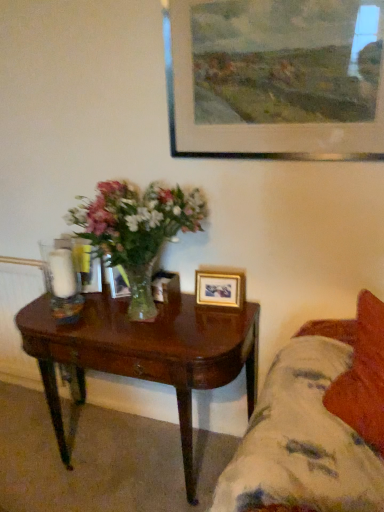
In order to face wooden picture frame at center, which is the third picture frame in front-to-back order, should I rotate leftwards or rightwards?

A 4.024 degree turn to the left will do.

What is the approximate width of dark wood coffee table at lower left?

44.66 centimeters.

I want to click on fluffy fabric couch at lower right, so click(x=316, y=424).

What do you see at coordinates (316, 424) in the screenshot? The image size is (384, 512). I see `fluffy fabric couch at lower right` at bounding box center [316, 424].

At what (x,y) coordinates should I click in order to perform the action: click on wooden picture frame at center, the 3th picture frame when ordered from top to bottom. Please return your answer as a coordinate pair (x, y). Looking at the image, I should click on (165, 286).

Looking at this image, from the image's perspective, does white glass candle holder at left appear lower than dark wood coffee table at lower left?

No, from the image's perspective, white glass candle holder at left is not beneath dark wood coffee table at lower left.

Which point is more distant from viewer, (61, 292) or (258, 313)?

Positioned behind is point (258, 313).

Choose the correct answer: Is white glass candle holder at left inside dark wood coffee table at lower left or outside it?

white glass candle holder at left exists outside the volume of dark wood coffee table at lower left.

Is white glass candle holder at left with dark wood coffee table at lower left?

They are not placed beside each other.

In the scene shown: Is white glass candle holder at left positioned with its back to fluffy fabric couch at lower right?

No, fluffy fabric couch at lower right is not at the back of white glass candle holder at left.

Is point (58, 283) positioned after point (366, 416)?

Yes, point (58, 283) is farther from viewer.

Which of these two, white glass candle holder at left or fluffy fabric couch at lower right, stands shorter?

Standing shorter between the two is white glass candle holder at left.

Measure the distance from white glass candle holder at left to fluffy fabric couch at lower right.

They are 1.00 meters apart.

Is wooden picture frame at center, the 3th picture frame when ordered from top to bottom, in front of or behind wooden picture frame at upper center, acting as the first picture frame starting from the top, in the image?

Visually, wooden picture frame at center, the 3th picture frame when ordered from top to bottom, is located behind wooden picture frame at upper center, acting as the first picture frame starting from the top.

From the image's perspective, between wooden picture frame at center, the 3th picture frame when ordered from top to bottom, and wooden picture frame at upper center, which is the 1th picture frame in front-to-back order, who is located below?

wooden picture frame at center, the 3th picture frame when ordered from top to bottom.

This screenshot has height=512, width=384. I want to click on the 2nd picture frame counting from the left of the wooden picture frame at upper center, which is the third picture frame from bottom to top, so click(165, 286).

Is wooden picture frame at upper center, which is the 1th picture frame in front-to-back order, inside wooden picture frame at center, which is counted as the first picture frame, starting from the back?

No.

How much distance is there between dark wood coffee table at lower left and fluffy fabric couch at lower right?

They are 19.92 inches apart.

Is dark wood coffee table at lower left next to fluffy fabric couch at lower right?

No, dark wood coffee table at lower left is not in contact with fluffy fabric couch at lower right.

Considering the positions of points (200, 382) and (269, 481), is point (200, 382) closer to camera compared to point (269, 481)?

No.

Considering the relative positions of dark wood coffee table at lower left and fluffy fabric couch at lower right in the image provided, is dark wood coffee table at lower left to the left or to the right of fluffy fabric couch at lower right?

From the image, it's evident that dark wood coffee table at lower left is to the left of fluffy fabric couch at lower right.

Consider the image. Does wooden picture frame at upper center, acting as the first picture frame starting from the top, have a larger size compared to wooden picture frame at center, which is the third picture frame in front-to-back order?

Yes, wooden picture frame at upper center, acting as the first picture frame starting from the top, is bigger than wooden picture frame at center, which is the third picture frame in front-to-back order.

This screenshot has width=384, height=512. Identify the location of the 2nd picture frame positioned above the wooden picture frame at center, the first picture frame positioned from the bottom (from the image's perspective). (275, 78).

Is wooden picture frame at upper center, acting as the first picture frame starting from the top, positioned far away from wooden picture frame at center, which is counted as the first picture frame, starting from the back?

They are positioned close to each other.

Which is correct: wooden picture frame at upper center, acting as the first picture frame starting from the top, is inside wooden picture frame at center, which is the third picture frame in front-to-back order, or outside of it?

wooden picture frame at upper center, acting as the first picture frame starting from the top, is located beyond the bounds of wooden picture frame at center, which is the third picture frame in front-to-back order.

Is gold metallic picture frame at lower right, which is counted as the second picture frame, starting from the front, bigger than wooden picture frame at center, which is counted as the first picture frame, starting from the back?

Incorrect, gold metallic picture frame at lower right, which is counted as the second picture frame, starting from the front, is not larger than wooden picture frame at center, which is counted as the first picture frame, starting from the back.

Who is taller, gold metallic picture frame at lower right, which is counted as the second picture frame, starting from the front, or wooden picture frame at center, which is counted as the first picture frame, starting from the back?

gold metallic picture frame at lower right, which is counted as the second picture frame, starting from the front.

Is gold metallic picture frame at lower right, which is counted as the second picture frame, starting from the front, not within wooden picture frame at center, the 3th picture frame when ordered from top to bottom?

Absolutely, gold metallic picture frame at lower right, which is counted as the second picture frame, starting from the front, is external to wooden picture frame at center, the 3th picture frame when ordered from top to bottom.

From the image's perspective, does gold metallic picture frame at lower right, positioned as the second picture frame in back-to-front order, appear higher than wooden picture frame at center, which is the third picture frame in front-to-back order?

Yes.

Where is `candle holder lying above the gold metallic picture frame at lower right, which is counted as the second picture frame, starting from the top (from the image's perspective)`? The image size is (384, 512). candle holder lying above the gold metallic picture frame at lower right, which is counted as the second picture frame, starting from the top (from the image's perspective) is located at coordinates (62, 280).

Is gold metallic picture frame at lower right, positioned as the second picture frame in back-to-front order, directly adjacent to white glass candle holder at left?

There is a gap between gold metallic picture frame at lower right, positioned as the second picture frame in back-to-front order, and white glass candle holder at left.

How many degrees apart are the facing directions of gold metallic picture frame at lower right, positioned as the second picture frame in back-to-front order, and white glass candle holder at left?

The angular difference between gold metallic picture frame at lower right, positioned as the second picture frame in back-to-front order, and white glass candle holder at left is 12.9 degrees.

Between gold metallic picture frame at lower right, positioned as the second picture frame in back-to-front order, and white glass candle holder at left, which one has less height?

With less height is gold metallic picture frame at lower right, positioned as the second picture frame in back-to-front order.

Where is `candle holder above the dark wood coffee table at lower left (from a real-world perspective)`? candle holder above the dark wood coffee table at lower left (from a real-world perspective) is located at coordinates (62, 280).

Where is `studio couch on the right of white glass candle holder at left`? This screenshot has width=384, height=512. studio couch on the right of white glass candle holder at left is located at coordinates pyautogui.click(x=316, y=424).

From the image, which object appears to be nearer to fluffy fabric couch at lower right, dark wood coffee table at lower left or gold metallic picture frame at lower right, positioned as the second picture frame in back-to-front order?

dark wood coffee table at lower left.

Which object lies further to the anchor point wooden picture frame at upper center, which is the third picture frame from bottom to top, gold metallic picture frame at lower right, which is counted as the second picture frame, starting from the front, or fluffy fabric couch at lower right?

Based on the image, fluffy fabric couch at lower right appears to be further to wooden picture frame at upper center, which is the third picture frame from bottom to top.

Looking at this image, from the image, which object appears to be farther from dark wood coffee table at lower left, white glass candle holder at left or gold metallic picture frame at lower right, which is counted as the second picture frame, starting from the top?

gold metallic picture frame at lower right, which is counted as the second picture frame, starting from the top, lies further to dark wood coffee table at lower left than the other object.

From the image, which object appears to be farther from fluffy fabric couch at lower right, wooden picture frame at upper center, which is the third picture frame from bottom to top, or dark wood coffee table at lower left?

wooden picture frame at upper center, which is the third picture frame from bottom to top, is further to fluffy fabric couch at lower right.

Estimate the real-world distances between objects in this image. Which object is closer to gold metallic picture frame at lower right, placed as the second picture frame when sorted from bottom to top, fluffy fabric couch at lower right or dark wood coffee table at lower left?

The object closer to gold metallic picture frame at lower right, placed as the second picture frame when sorted from bottom to top, is dark wood coffee table at lower left.

Considering their positions, is fluffy fabric couch at lower right positioned further to gold metallic picture frame at lower right, placed as the second picture frame when sorted from bottom to top, than wooden picture frame at upper center, acting as the first picture frame starting from the top?

wooden picture frame at upper center, acting as the first picture frame starting from the top, is positioned further to the anchor gold metallic picture frame at lower right, placed as the second picture frame when sorted from bottom to top.

When comparing their distances from white glass candle holder at left, does wooden picture frame at center, which is the third picture frame in front-to-back order, or fluffy fabric couch at lower right seem further?

The object further to white glass candle holder at left is fluffy fabric couch at lower right.

Estimate the real-world distances between objects in this image. Which object is further from fluffy fabric couch at lower right, dark wood coffee table at lower left or wooden picture frame at upper center, acting as the first picture frame starting from the top?

wooden picture frame at upper center, acting as the first picture frame starting from the top, is positioned further to the anchor fluffy fabric couch at lower right.

This screenshot has height=512, width=384. Identify the location of coffee table between white glass candle holder at left and gold metallic picture frame at lower right, placed as the second picture frame when sorted from bottom to top. (145, 354).

I want to click on candle holder that lies between wooden picture frame at upper center, which is the third picture frame from bottom to top, and wooden picture frame at center, the 3th picture frame when ordered from top to bottom, from top to bottom, so click(x=62, y=280).

Where is `coffee table located between white glass candle holder at left and fluffy fabric couch at lower right in the left-right direction`? coffee table located between white glass candle holder at left and fluffy fabric couch at lower right in the left-right direction is located at coordinates (145, 354).

What are the coordinates of `candle holder that lies between wooden picture frame at upper center, positioned as the third picture frame in back-to-front order, and dark wood coffee table at lower left from top to bottom` in the screenshot? It's located at (62, 280).